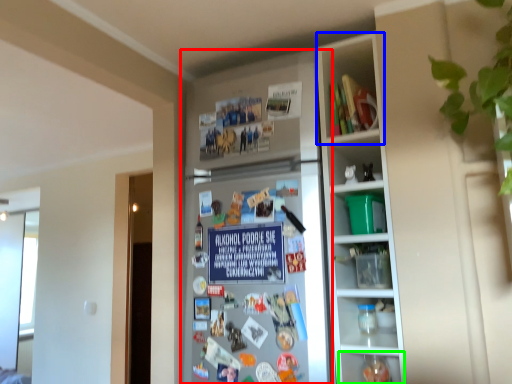
Question: Based on their relative distances, which object is farther from fridge (highlighted by a red box)? Choose from cabinet (highlighted by a blue box) and shelf (highlighted by a green box).

Choices:
 (A) cabinet
 (B) shelf

Answer: (B)